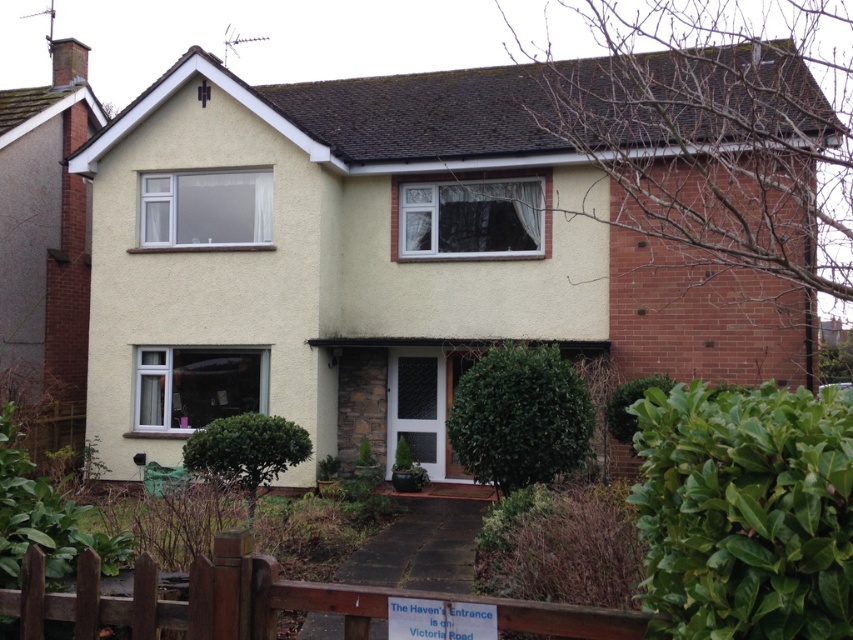
From the picture: You are a gardener planning to trim the green leafy hedge at lower right and the green leafy hedge at lower center. Which hedge requires more time to trim based on their sizes?

The green leafy hedge at lower center requires more time to trim since it is larger than the green leafy hedge at lower right.

Based on the photo, you are a gardener planning to trim the green leafy hedge at lower right and the green leafy bush at center. Which one requires more time due to its size?

The green leafy bush at center requires more time because it is larger than the green leafy hedge at lower right.